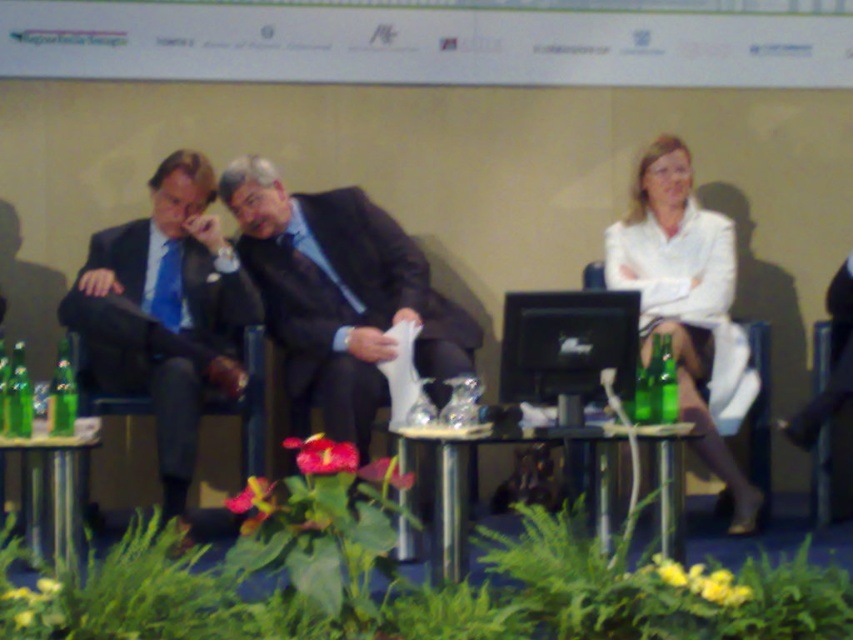
You are sitting in the audience and want to point out the person wearing the matte black suit at left. Based on their position relative to the stage backdrop, can you describe where exactly they are seated?

The matte black suit at left is located at point coordinates 0.492 on the x and 0.195 on the y axis, which places them centrally on the stage near the lower portion, likely seated in the middle of the front row.

You are a stagehand preparing to move a 90 cm wide equipment cart onto the stage. You notice the matte black suit at left and the green glass bottle at lower left. Can you safely maneuver the cart between them without knocking anything over?

The distance between the matte black suit at left and the green glass bottle at lower left is 89.42 centimeters. Since the cart is 90 cm wide, it is slightly wider than the space available. Therefore, you cannot safely maneuver the cart between them without risking contact.

You are an event organizer who needs to place a 1.2 meter wide banner on the clear glass table at center. Based on the scene description, can you determine if the table is large enough to accommodate the banner?

The clear glass table at center is located at point (554, 442). However, the dimensions of the table are not provided in the Objects Description. Therefore, it is impossible to determine if the table is large enough to accommodate the 1.2 meter wide banner based on the given information.